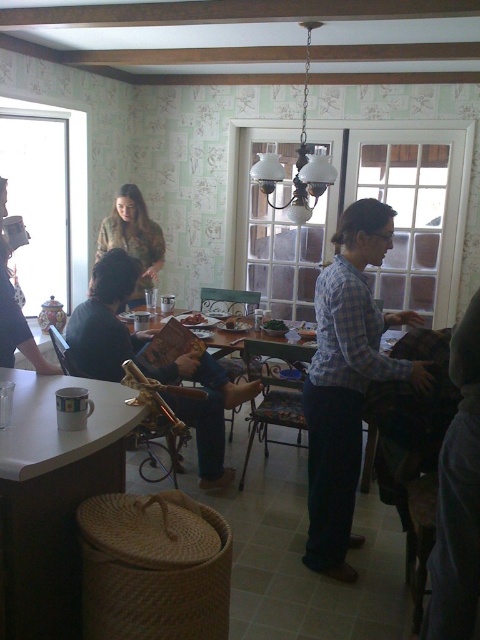
Looking at this image, you are standing at the point marked as point (36, 404) and want to reach the kitchen island in the foreground. The kitchen island is 1.96 meters away from your current position. If you walk straight towards the kitchen island, will you be able to reach it without any obstacles?

Yes, you can reach the kitchen island by walking straight since there are no obstacles mentioned between point (36, 404) and the kitchen island, and the distance is 1.96 meters.